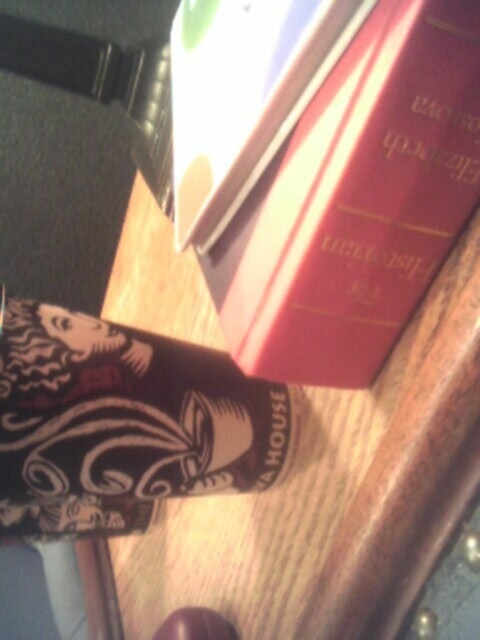
You are organizing a bookshelf and need to place the matte red book at center and the matte black book at center. According to their positions in the image, which book should you place on the right side of the other?

The matte red book at center should be placed on the right side of the matte black book at center because in the image, the matte red book at center is positioned on the right side of the matte black book at center.

You are organizing a bookshelf and need to place the matte red book at center and the matte black book at center. Based on their positions in the image, which book should you place first to maintain the same spatial arrangement?

You should place the matte black book at center first, then the matte red book at center on top of it since the matte red book at center is in front of the matte black book at center in the image.